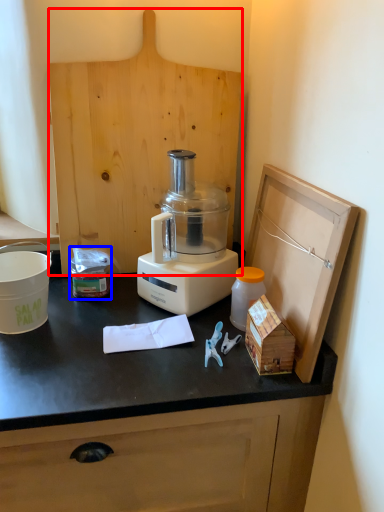
Question: Which of the following is the farthest to the observer, wood (highlighted by a red box) or waste (highlighted by a blue box)?

Choices:
 (A) wood
 (B) waste

Answer: (B)